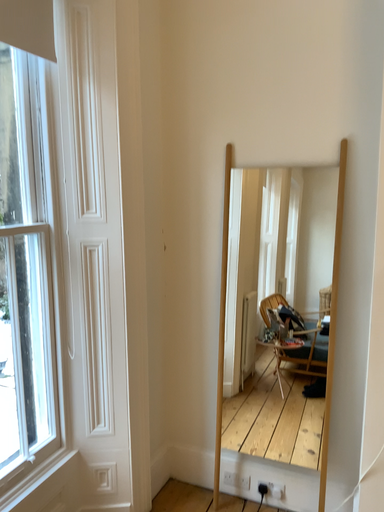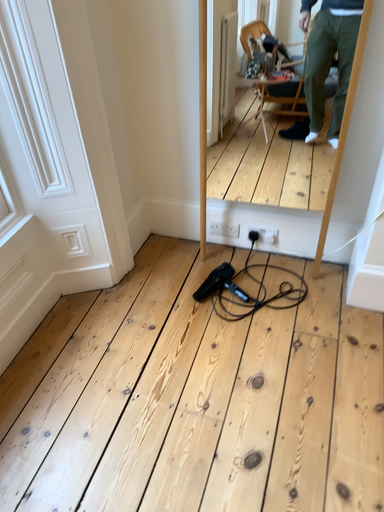
Question: Which way did the camera rotate in the video?

Choices:
 (A) rotated downward
 (B) rotated upward

Answer: (A)